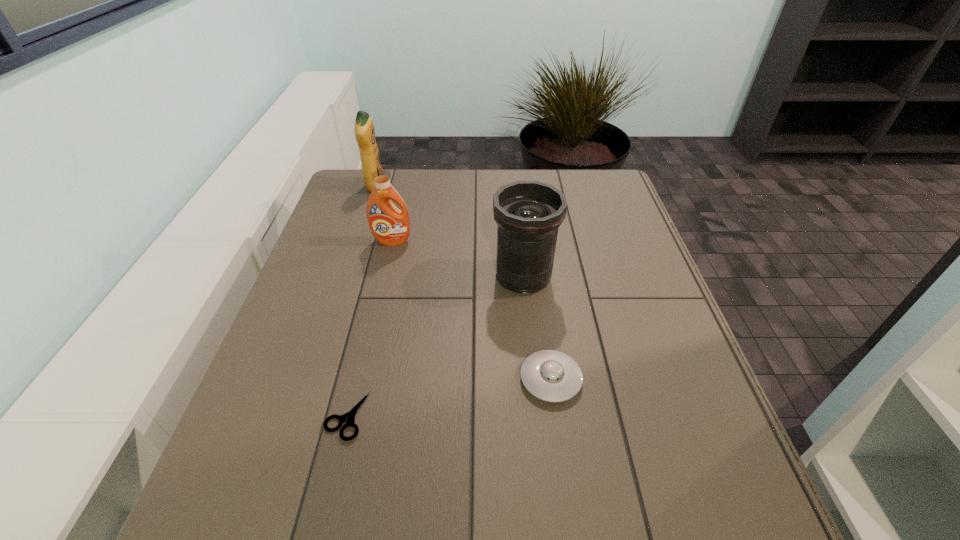
Point out which object is positioned as the second nearest to the telephoto lens. Please provide its 2D coordinates. Your answer should be formatted as a tuple, i.e. [(x, y)], where the tuple contains the x and y coordinates of a point satisfying the conditions above.

[(390, 226)]

Find the location of `vacant space that satisfies the following two spatial constraints: 1. on the front-facing side of the third farthest object; 2. on the right side of the second farthest object`. vacant space that satisfies the following two spatial constraints: 1. on the front-facing side of the third farthest object; 2. on the right side of the second farthest object is located at coordinates (384, 276).

Where is `vacant point that satisfies the following two spatial constraints: 1. on the back side of the shears; 2. on the label of the leftmost object`? Image resolution: width=960 pixels, height=540 pixels. vacant point that satisfies the following two spatial constraints: 1. on the back side of the shears; 2. on the label of the leftmost object is located at coordinates (402, 187).

Find the location of a particular element. The width and height of the screenshot is (960, 540). vacant space that satisfies the following two spatial constraints: 1. on the front-facing side of the nearer detergent; 2. on the left side of the third farthest object is located at coordinates (384, 276).

The height and width of the screenshot is (540, 960). What are the coordinates of `free space that satisfies the following two spatial constraints: 1. on the label of the farther detergent; 2. on the back side of the telephoto lens` in the screenshot? It's located at click(347, 276).

This screenshot has height=540, width=960. I want to click on free space that satisfies the following two spatial constraints: 1. on the label of the saucer; 2. on the left side of the taller detergent, so click(313, 379).

Image resolution: width=960 pixels, height=540 pixels. What are the coordinates of `vacant region that satisfies the following two spatial constraints: 1. on the label of the farthest object; 2. on the left side of the second shortest object` in the screenshot? It's located at (313, 379).

At what (x,y) coordinates should I click in order to perform the action: click on vacant space that satisfies the following two spatial constraints: 1. on the label of the farther detergent; 2. on the back side of the second shortest object. Please return your answer as a coordinate pair (x, y). This screenshot has height=540, width=960. Looking at the image, I should click on coord(313,379).

Where is `free space that satisfies the following two spatial constraints: 1. on the label of the telephoto lens; 2. on the left side of the leftmost object`? free space that satisfies the following two spatial constraints: 1. on the label of the telephoto lens; 2. on the left side of the leftmost object is located at coordinates (347, 276).